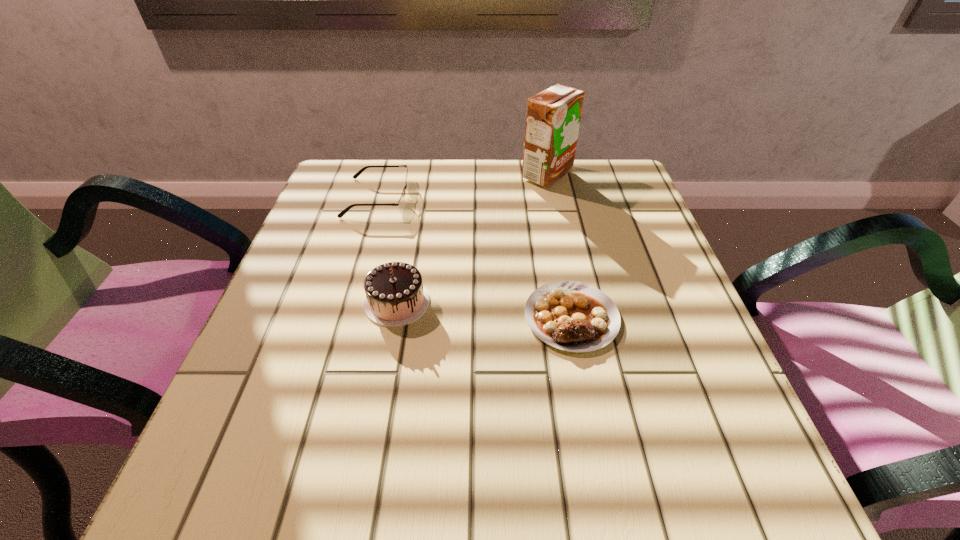
Find the location of a particular element. free space that satisfies the following two spatial constraints: 1. on the back side of the third shortest object; 2. on the front-facing side of the second shortest object is located at coordinates (417, 198).